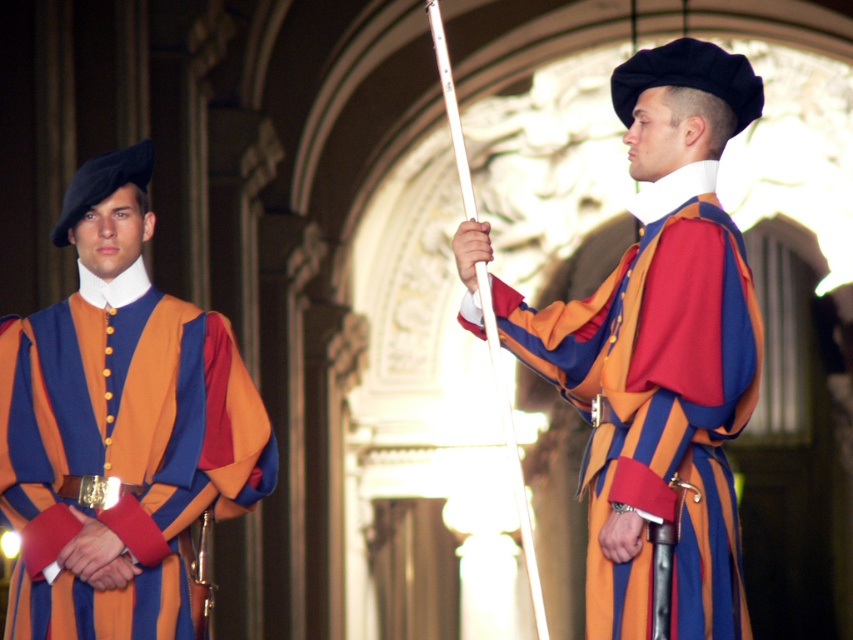
You are an architect designing a new historical exhibit and need to place a replica of the tunic at point [660,353]. According to the scene, what is the exact location and description of the object at that point?

At point 0.556, 0.776 lies matte orange and blue striped tunic at center.

You are an artist trying to paint the scene described. When painting the matte orange and blue striped tunic at center and the matte orange vest at center, which one should you paint first to ensure proper layering?

The matte orange vest at center should be painted first because the matte orange and blue striped tunic at center is above it, meaning the vest is underneath and needs to be the base layer.